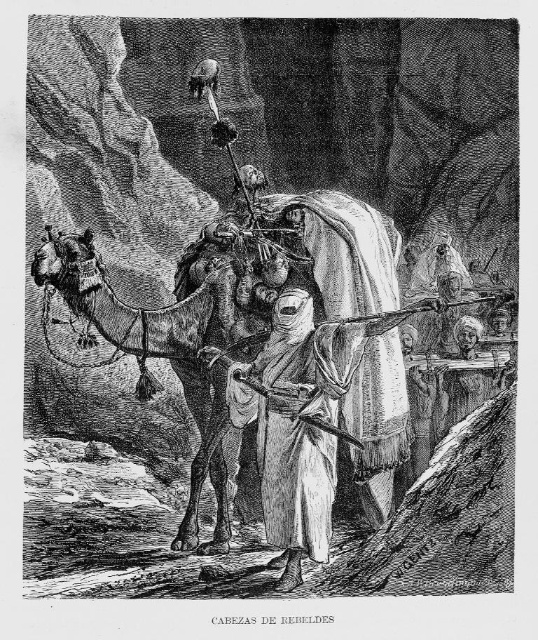
Question: Which point is farther to the camera?

Choices:
 (A) white clothed figure at center
 (B) brown textured camel at center

Answer: (B)

Question: Which point appears farthest from the camera in this image?

Choices:
 (A) (186, 344)
 (B) (335, 484)

Answer: (A)

Question: Which point is farther from the camera taking this photo?

Choices:
 (A) [146, 340]
 (B) [293, 566]

Answer: (A)

Question: Can you confirm if brown textured camel at center is positioned above white clothed figure at center?

Choices:
 (A) no
 (B) yes

Answer: (B)

Question: Can you confirm if brown textured camel at center is bigger than white clothed figure at center?

Choices:
 (A) yes
 (B) no

Answer: (A)

Question: Does brown textured camel at center have a larger size compared to white clothed figure at center?

Choices:
 (A) no
 (B) yes

Answer: (B)